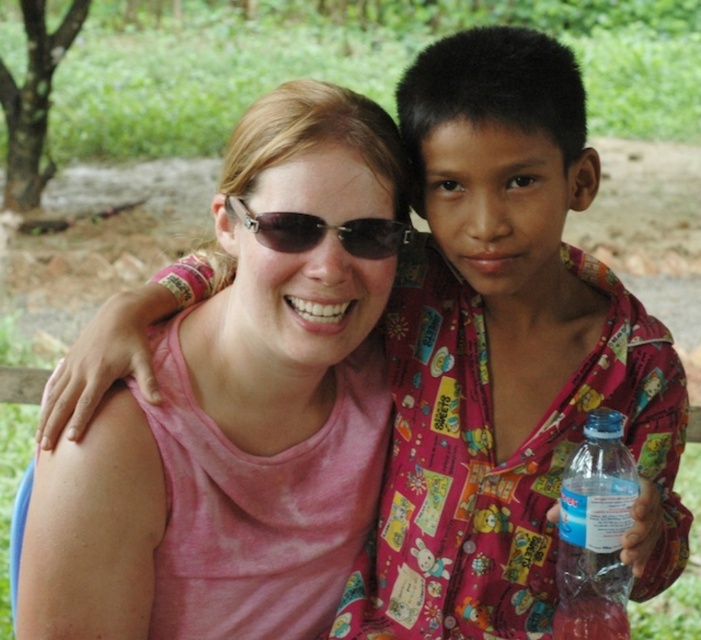
You are a photographer taking a picture of the two people in the scene. You need to ensure that both the clear plastic bottle at lower right and the matte black sunglasses at center are visible in the frame. Based on their positions, which object should you focus on first to make sure both are in the shot?

The clear plastic bottle at lower right is located below matte black sunglasses at center, so you should focus on the matte black sunglasses at center first to ensure both objects are in the frame.

You are a photographer trying to capture a candid shot of the two people in the scene. You need to ensure that both the clear plastic bottle at lower right and the matte black sunglasses at center are visible in the frame. Given their sizes, which object might require you to adjust your camera angle to include it properly?

The clear plastic bottle at lower right has a greater height compared to the matte black sunglasses at center, so it might require adjusting the camera angle to ensure it fits within the frame.

You are a photographer at the scene. You want to take a photo of the clear plastic bottle at lower right and the matte black sunglasses at center. Which object should you focus on if you want to capture the larger one in the frame?

The clear plastic bottle at lower right is bigger than the matte black sunglasses at center, so you should focus on the clear plastic bottle at lower right to capture the larger one in the frame.